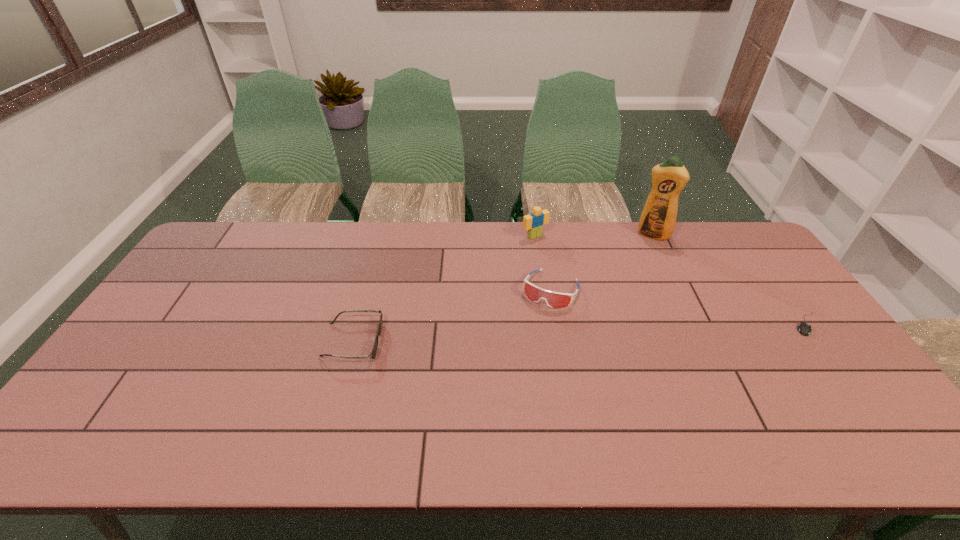
Where is `blank area located 0.220m on the back of the shortest object`? blank area located 0.220m on the back of the shortest object is located at coordinates (763, 264).

The height and width of the screenshot is (540, 960). Identify the location of free location located 0.050m on the label of the detergent. (646, 249).

Where is `free space located on the label of the detergent`? The width and height of the screenshot is (960, 540). free space located on the label of the detergent is located at coordinates click(627, 305).

Where is `blank space located 0.200m on the label of the detergent`? Image resolution: width=960 pixels, height=540 pixels. blank space located 0.200m on the label of the detergent is located at coordinates (637, 275).

Locate an element on the screen. free point located 0.070m on the face of the Lego is located at coordinates (553, 252).

Identify the location of vacant region located on the face of the Lego. (564, 264).

This screenshot has height=540, width=960. Identify the location of vacant region located 0.180m on the face of the Lego. (572, 271).

The image size is (960, 540). Identify the location of vacant space positioned 0.300m on the front-facing side of the third tallest object. (502, 386).

The height and width of the screenshot is (540, 960). What are the coordinates of `vacant area situated 0.190m on the front-facing side of the third tallest object` in the screenshot? It's located at (518, 355).

Locate an element on the screen. This screenshot has width=960, height=540. vacant space located 0.390m on the front-facing side of the third tallest object is located at coordinates (488, 415).